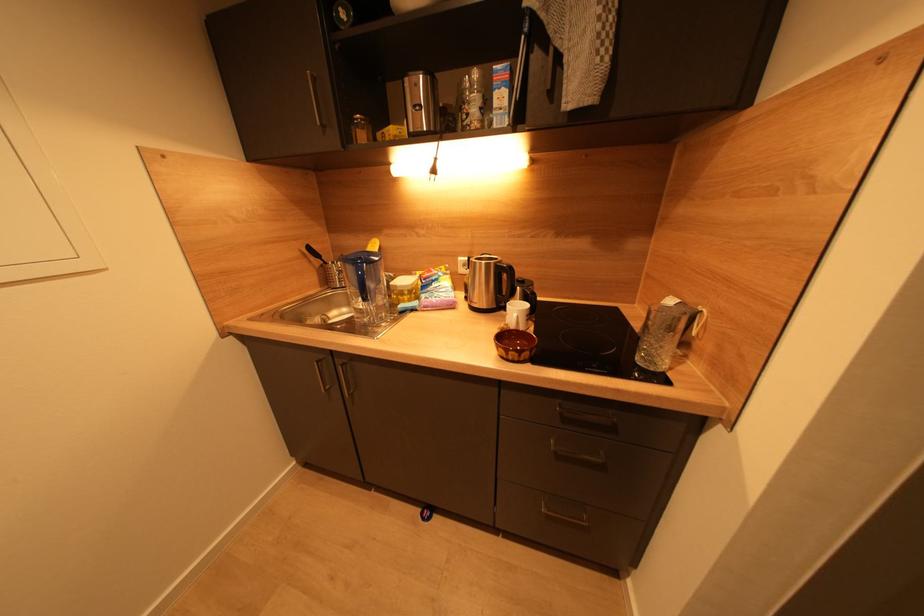
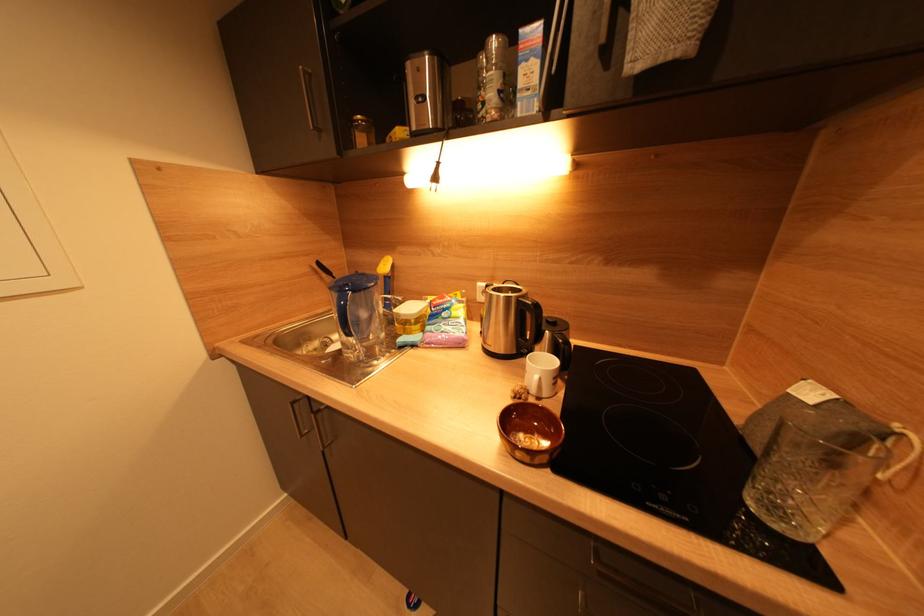
From the picture: What movement of the cameraman would produce the second image?

The movement direction of the cameraman is right, forward.